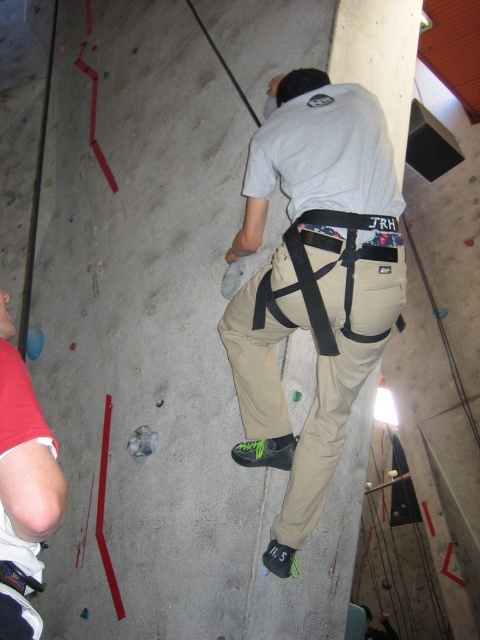
Does khaki cotton pants at center have a larger size compared to matte khaki pants at lower left?

Yes.

Is khaki cotton pants at center taller than matte khaki pants at lower left?

Correct, khaki cotton pants at center is much taller as matte khaki pants at lower left.

This screenshot has width=480, height=640. What are the coordinates of `khaki cotton pants at center` in the screenshot? It's located at (313, 284).

Image resolution: width=480 pixels, height=640 pixels. Find the location of `khaki cotton pants at center`. khaki cotton pants at center is located at coordinates (313, 284).